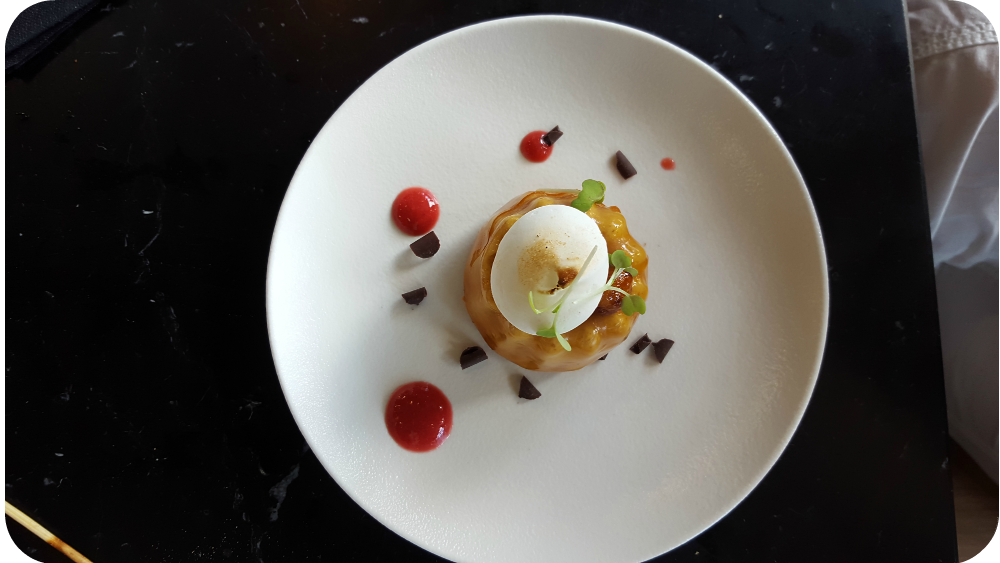
Find the location of `white plate`. white plate is located at coordinates (658, 464).